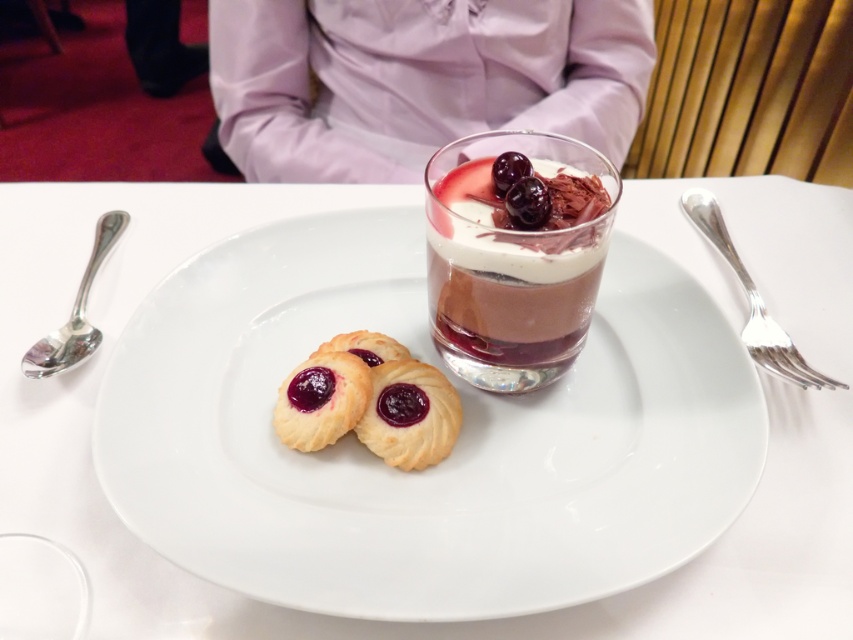
You are a food critic analyzing the dessert presentation. The chocolate mousse at center is represented by point (515, 259). Where is the chocolate mousse located in relation to the cookies and the layered dessert?

The chocolate mousse at center is located at point (515, 259), which is the central position of the plate, equidistant between the cookies and the layered dessert.